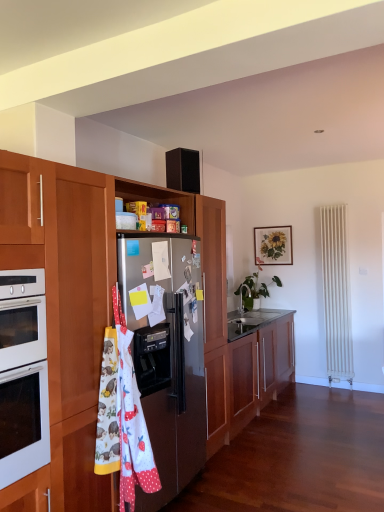
Question: Would you say satin metallic refrigerator at center-left is inside or outside wooden cabinet at center, the first cabinetry viewed from the top?

Choices:
 (A) outside
 (B) inside

Answer: (B)

Question: In the image, is satin metallic refrigerator at center-left positioned in front of or behind wooden cabinet at center, the first cabinetry viewed from the top?

Choices:
 (A) front
 (B) behind

Answer: (B)

Question: Which is nearer to the wooden picture frame at upper center?

Choices:
 (A) white fabric apron at center-left
 (B) wooden cabinet at center, the first cabinetry viewed from the top
 (C) wooden cabinet at center, which is the first cabinetry from bottom to top
 (D) green glossy plant at center
 (E) satin metallic refrigerator at center-left

Answer: (D)

Question: Estimate the real-world distances between objects in this image. Which object is farther from the wooden picture frame at upper center?

Choices:
 (A) white fabric apron at center-left
 (B) satin metallic refrigerator at center-left
 (C) wooden cabinet at center, which is the first cabinetry from bottom to top
 (D) wooden cabinet at center, marked as the 2th cabinetry in a bottom-to-top arrangement
 (E) green glossy plant at center

Answer: (A)